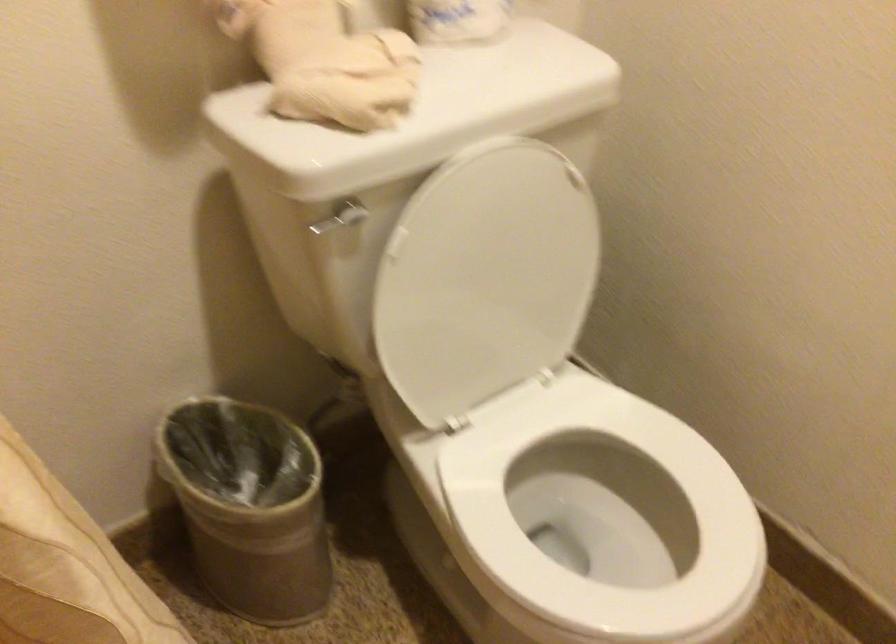
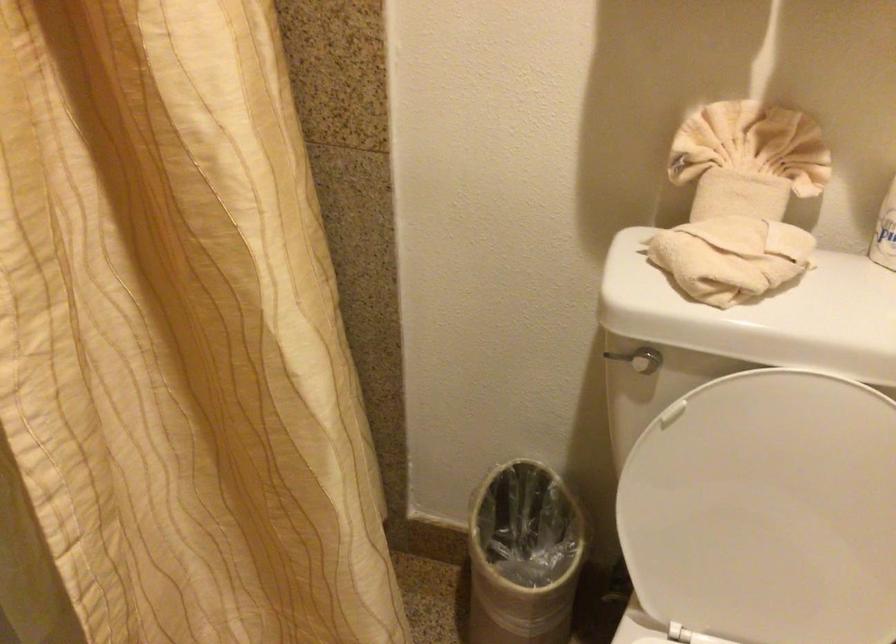
Question: The camera is either moving clockwise (left) or counter-clockwise (right) around the object. The first image is from the beginning of the video and the second image is from the end. Is the camera moving left or right when shooting the video?

Choices:
 (A) Left
 (B) Right

Answer: (B)